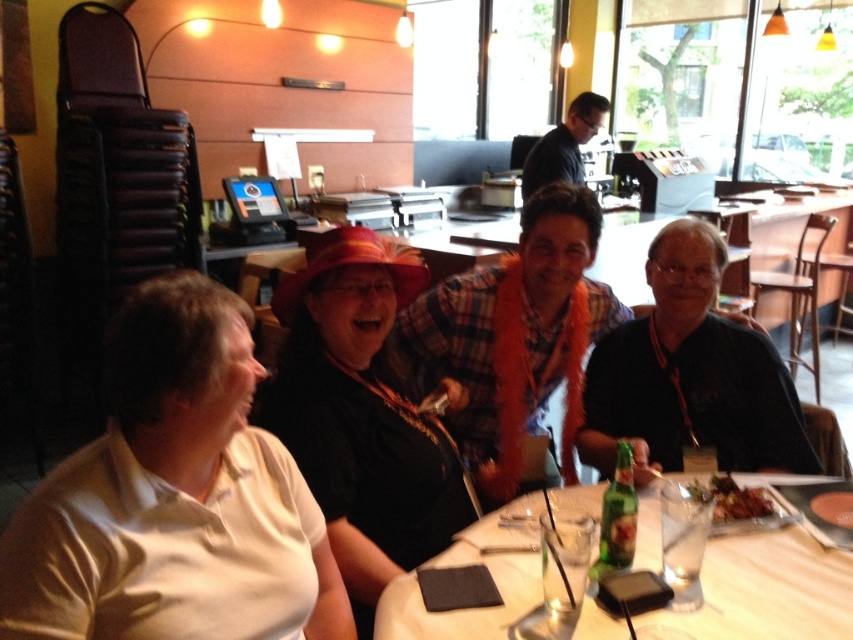
You are a waiter in a restaurant and need to deliver a dessert to the table. The dessert needs to be placed on the shiny brown plate at table center. However, you must avoid touching the black fabric shirt at right. Can you safely place the dessert on the plate without coming into contact with the shirt?

The black fabric shirt at right and shiny brown plate at table center are 38.35 centimeters apart from each other. Since the distance between them is sufficient, you can safely place the dessert on the shiny brown plate at table center without touching the black fabric shirt at right.

You are a photographer standing in the dining area and want to take a photo of both the white matte shirt at left and the matte black shirt at center. Which shirt should you focus on first to ensure both are in the frame?

The white matte shirt at left is positioned under the matte black shirt at center, so you should focus on the matte black shirt at center first to ensure both are in the frame.